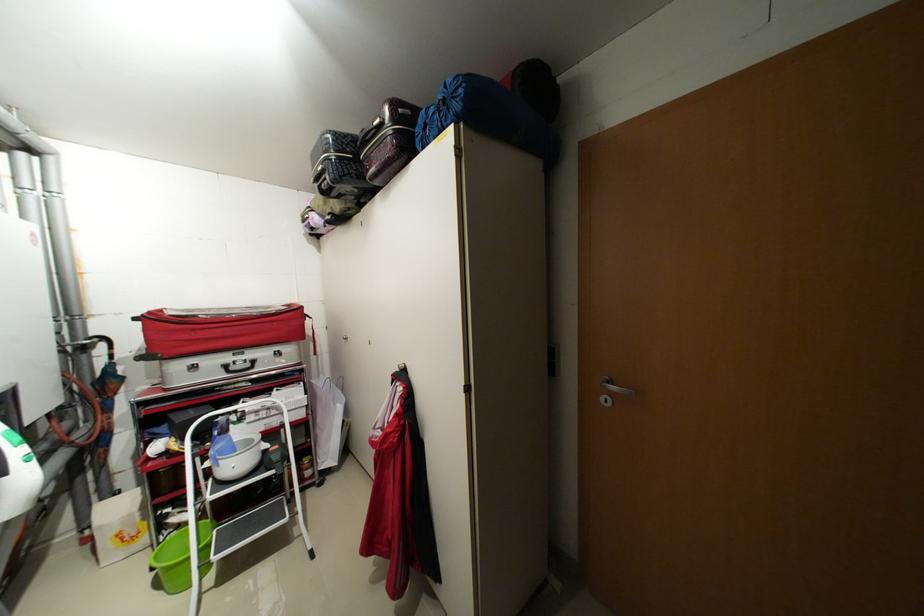
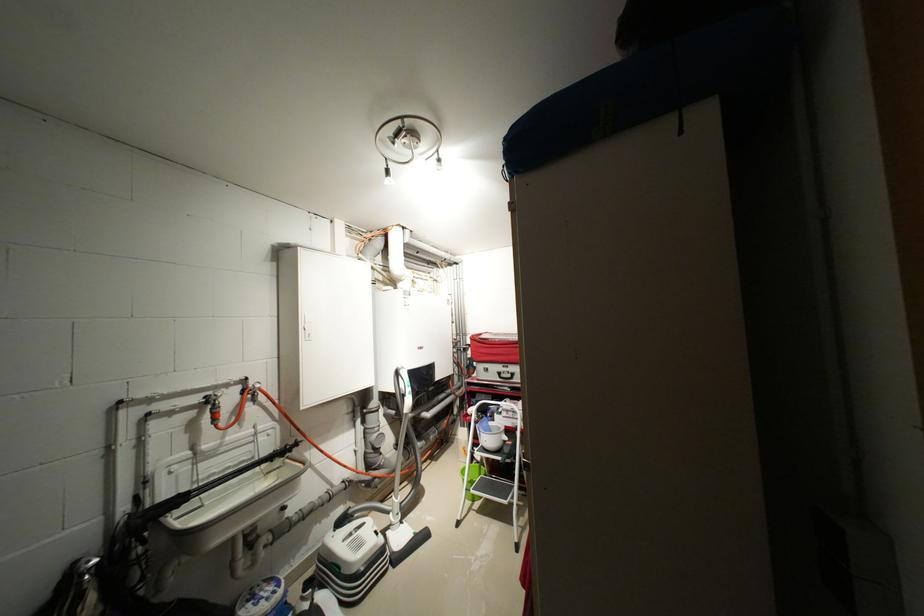
Locate, in the second image, the point that corresponds to [263,411] in the first image.

(515, 411)